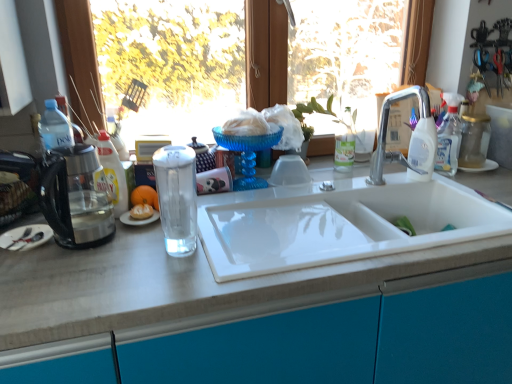
In order to click on vacant area that is in front of clear glass water at center in this screenshot , I will do `click(161, 280)`.